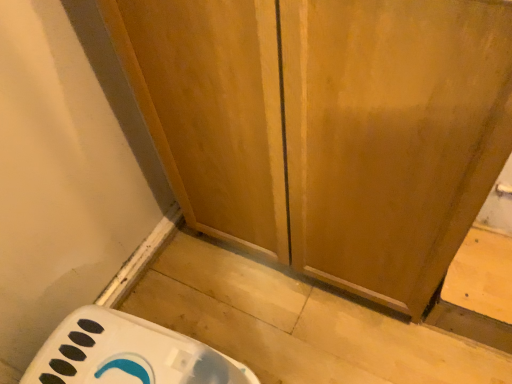
Image resolution: width=512 pixels, height=384 pixels. I want to click on empty space that is ontop of white plastic cabinet at lower left (from a real-world perspective), so click(x=128, y=353).